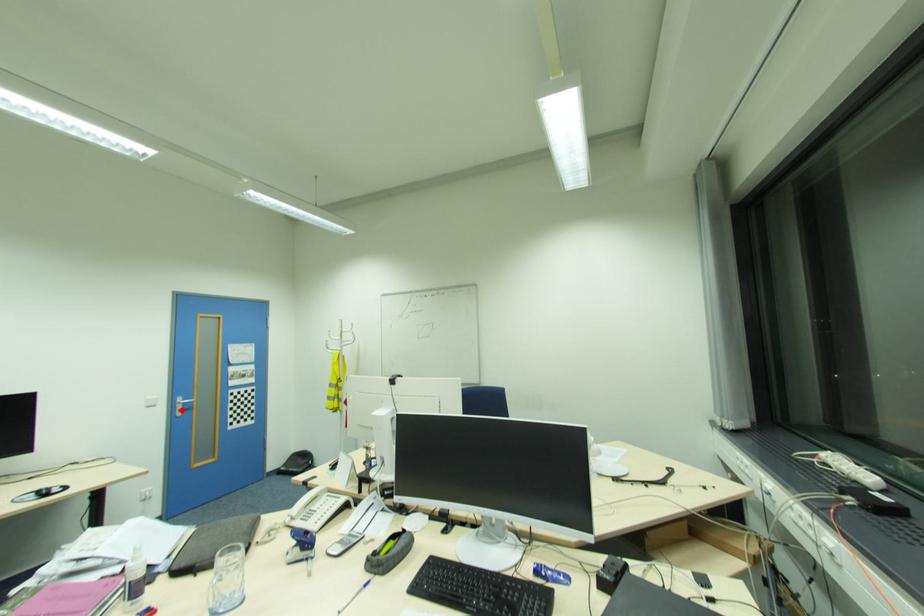
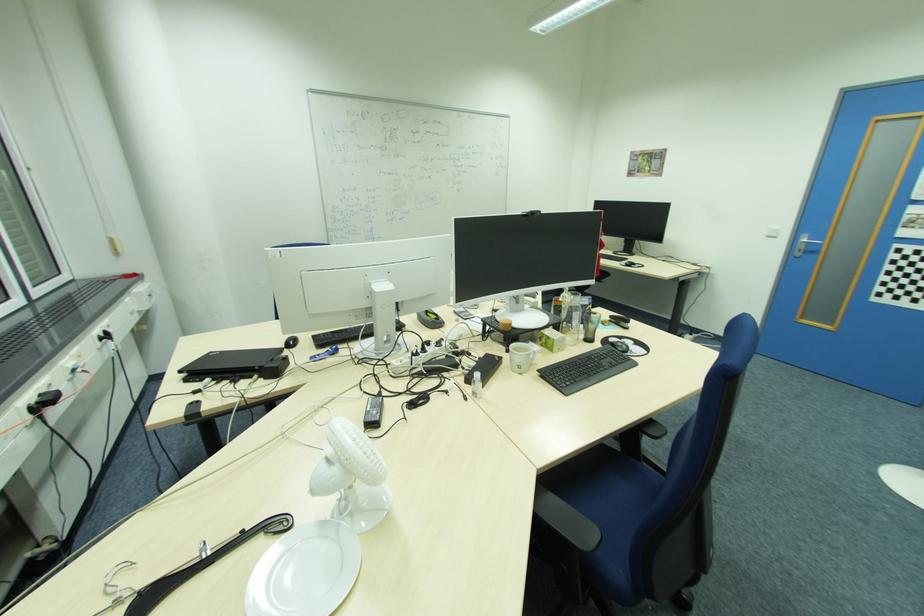
In the second image, find the point that corresponds to the highlighted location in the first image.

(804, 251)